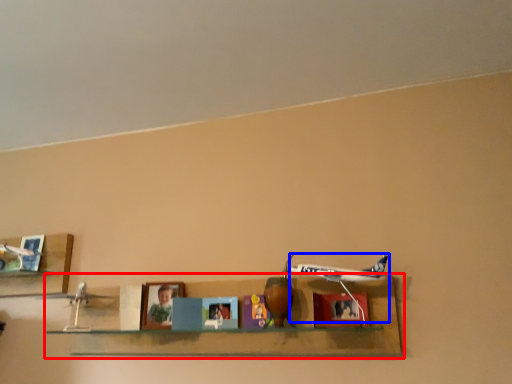
Question: Among these objects, which one is farthest to the camera, shelf (highlighted by a red box) or plane (highlighted by a blue box)?

Choices:
 (A) shelf
 (B) plane

Answer: (B)